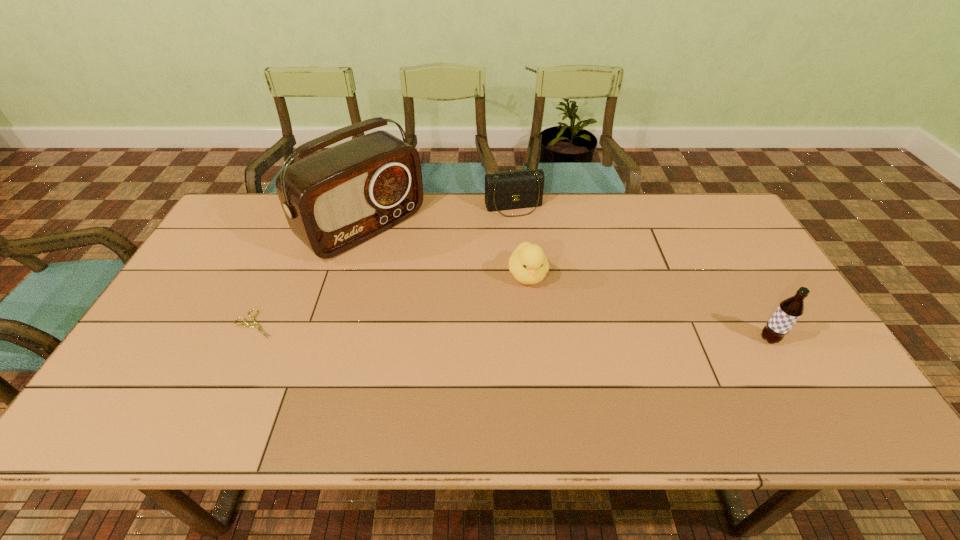
This screenshot has width=960, height=540. What are the coordinates of `vacant space on the desktop that is between the shortest object and the root beer and is positioned on the front flap of the clutch bag` in the screenshot? It's located at (562, 333).

Image resolution: width=960 pixels, height=540 pixels. What are the coordinates of `vacant space on the desktop that is between the shortest object and the rightmost object and is positioned on the front panel of the radio receiver` in the screenshot? It's located at (492, 331).

Locate an element on the screen. The image size is (960, 540). free spot on the desktop that is between the shears and the root beer and is positioned on the front-facing side of the duck is located at coordinates (544, 333).